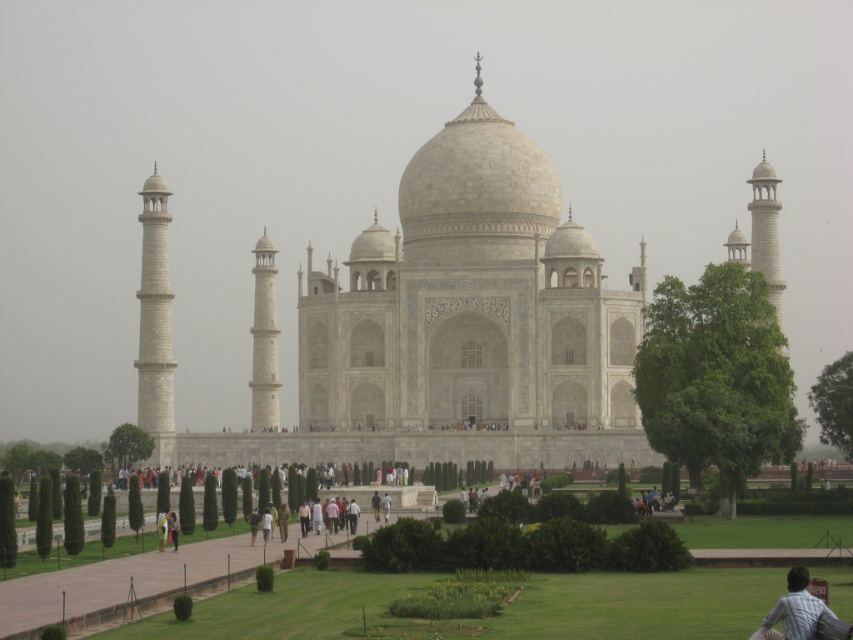
You are a tourist visiting the Taj Mahal and you see the green grass at center and the light brown striped shirt at lower right. Which object is closer to the ground?

The green grass at center is closer to the ground because it is positioned below the light brown striped shirt at lower right.

You are a photographer planning to capture the Taj Mahal from a low angle to emphasize its height. Given that the white marble taj mahal at center is positioned above the green grass at center, which object should you focus on to achieve this effect?

To emphasize the height of the white marble taj mahal at center, focus on the white marble taj mahal at center since it is elevated above the green grass at center, creating a vertical composition.